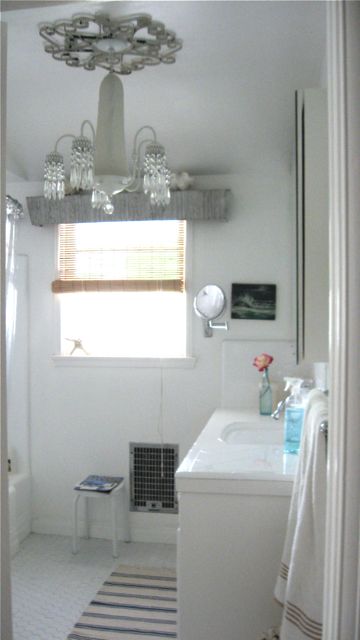
Find the location of a particular element. tile floor is located at coordinates (64, 593).